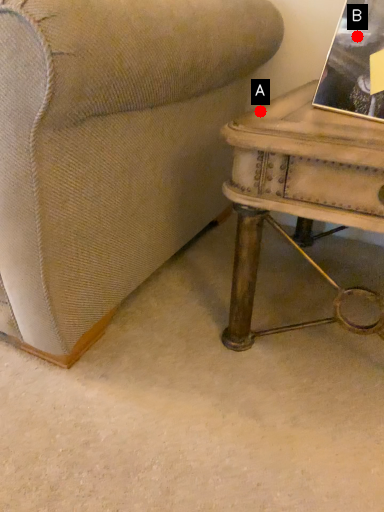
Question: Two points are circled on the image, labeled by A and B beside each circle. Which of the following is the closest to the observer?

Choices:
 (A) A is closer
 (B) B is closer

Answer: (B)